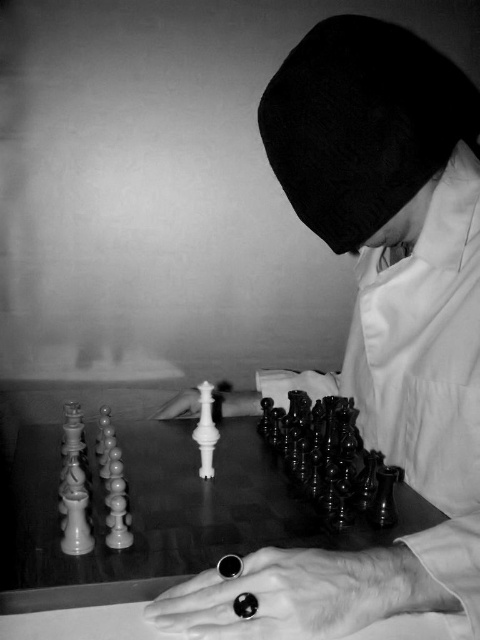
Who is shorter, smooth black chess pieces at center or black polished ring at lower center?

black polished ring at lower center is shorter.

Does smooth black chess pieces at center have a greater width compared to black polished ring at lower center?

Yes, smooth black chess pieces at center is wider than black polished ring at lower center.

Which is behind, point (443, 497) or point (377, 600)?

Point (443, 497)

Image resolution: width=480 pixels, height=640 pixels. Identify the location of smooth black chess pieces at center. (377, 324).

Where is `wooden chessboard at center`? This screenshot has height=640, width=480. wooden chessboard at center is located at coordinates click(164, 515).

Can you confirm if wooden chessboard at center is positioned to the right of white glossy chess piece at center?

In fact, wooden chessboard at center is to the left of white glossy chess piece at center.

Who is more distant from viewer, (110, 584) or (228, 413)?

The point (228, 413) is behind.

I want to click on wooden chessboard at center, so click(164, 515).

Between black polished ring at lower center and white glossy chess piece at center, which one appears on the right side from the viewer's perspective?

black polished ring at lower center is more to the right.

Image resolution: width=480 pixels, height=640 pixels. Describe the element at coordinates (282, 596) in the screenshot. I see `black polished ring at lower center` at that location.

Locate an element on the screen. Image resolution: width=480 pixels, height=640 pixels. black polished ring at lower center is located at coordinates (282, 596).